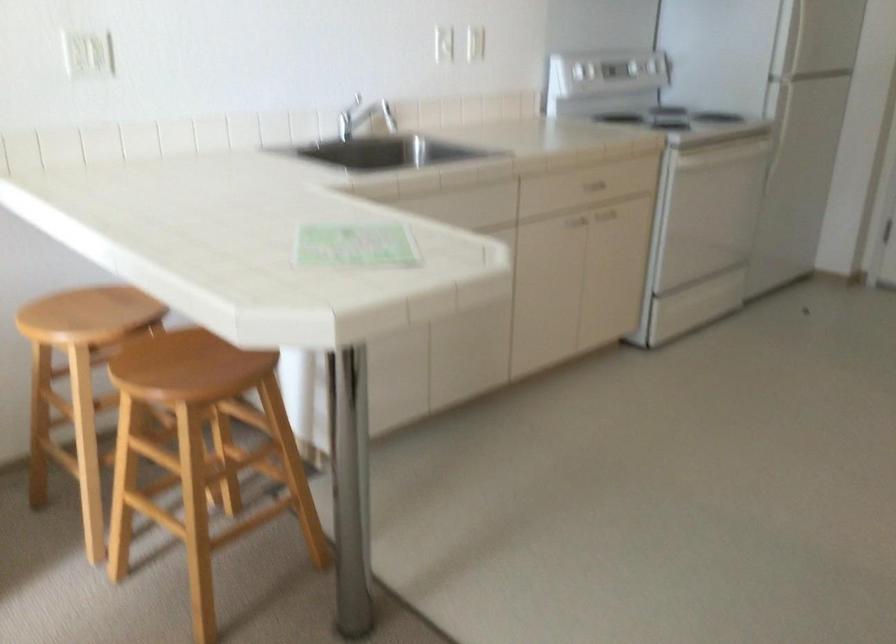
What do you see at coordinates (609, 71) in the screenshot?
I see `a white stove knob` at bounding box center [609, 71].